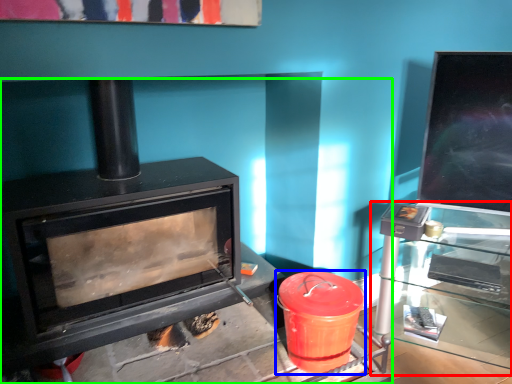
Question: Based on their relative distances, which object is farther from table (highlighted by a red box)? Choose from crock pot (highlighted by a blue box) and wood burning stove (highlighted by a green box).

Choices:
 (A) crock pot
 (B) wood burning stove

Answer: (B)